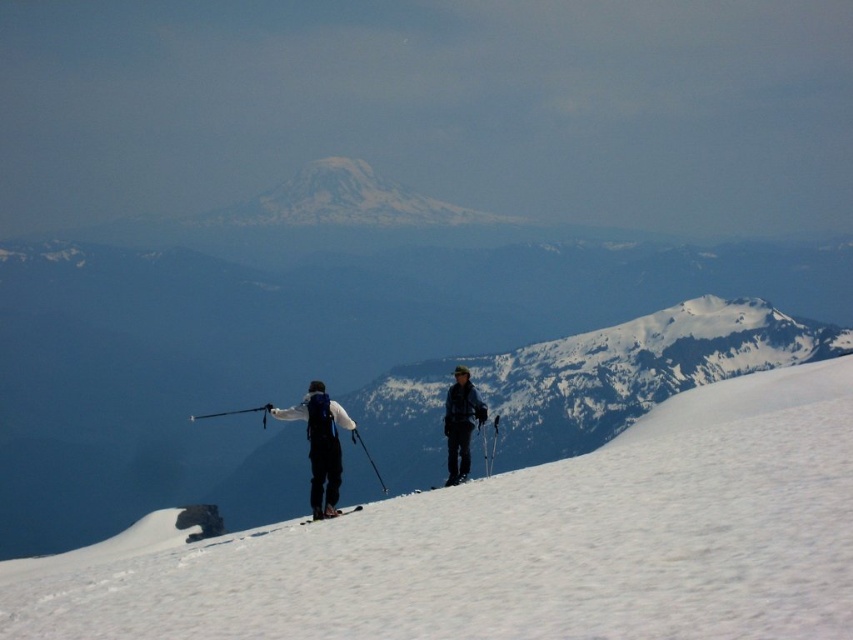
You are a drone operator tasked with capturing aerial footage of the two people on the snow slope. You need to ensure that both the white fabric jacket at center and the dark blue ski suit at center are clearly visible in the frame. Given that your drone camera has a maximum effective range of 100 feet, can you safely capture both individuals without exceeding this limit?

The white fabric jacket at center is 126.43 feet away from the dark blue ski suit at center. Since the distance between them exceeds the drone camera maximum effective range of 100 feet, you cannot safely capture both individuals in the frame without exceeding the limit.

You are a photographer planning to capture a photo of the white fabric jacket at center and the black matte ski at lower center. Which object should you focus on first if you want to ensure both are in the frame without moving the camera? Explain your reasoning based on their sizes.

The white fabric jacket at center is wider than the black matte ski at lower center. Since the jacket is wider, focusing on it first would help ensure both objects remain within the camera frame without needing to adjust the camera position.

You are standing on the slope and see the white snow at center and the black matte ski pole at center. Which object is positioned to the right of the other?

The white snow at center is to the right of the black matte ski pole at center.